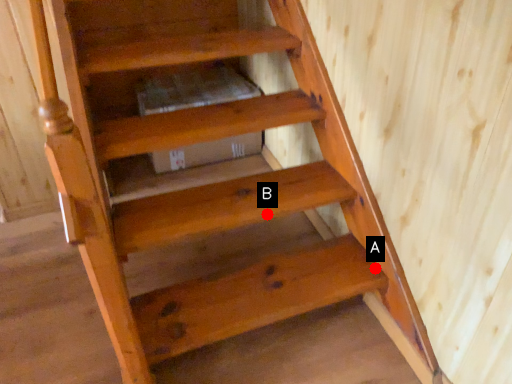
Question: Two points are circled on the image, labeled by A and B beside each circle. Which point is closer to the camera?

Choices:
 (A) A is closer
 (B) B is closer

Answer: (B)